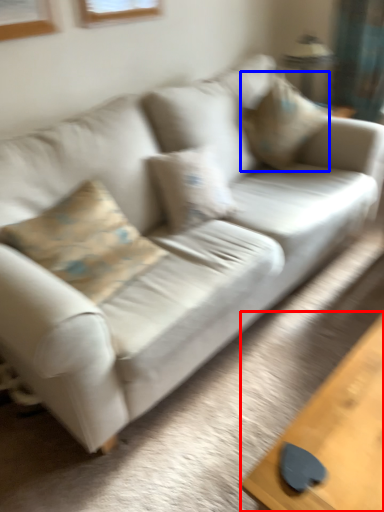
Question: Which object appears closest to the camera in this image, table (highlighted by a red box) or pillow (highlighted by a blue box)?

Choices:
 (A) table
 (B) pillow

Answer: (A)